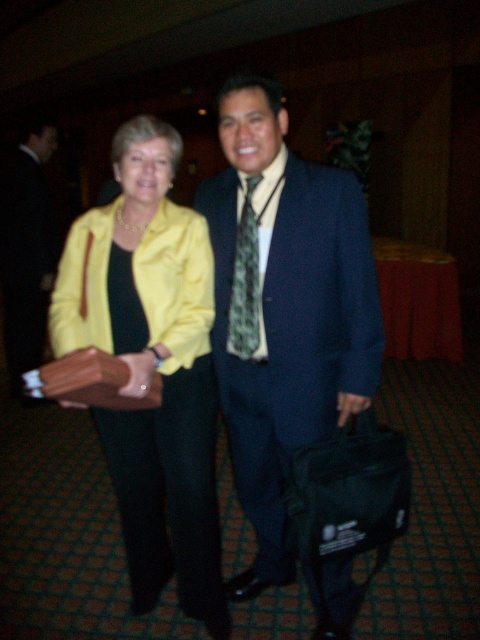
You are organizing a formal event and need to arrange seating based on the attendees clothing. You see the matte black suit at center and the green patterned tie at center. Which clothing item is positioned to the left?

The matte black suit at center is to the left of the green patterned tie at center.

You are organizing a formal event and need to ensure proper attire coordination. You notice the matte black suit at center and the green patterned tie at center. Which item is placed above the other?

The matte black suit at center is positioned over the green patterned tie at center, meaning the suit is above the tie.